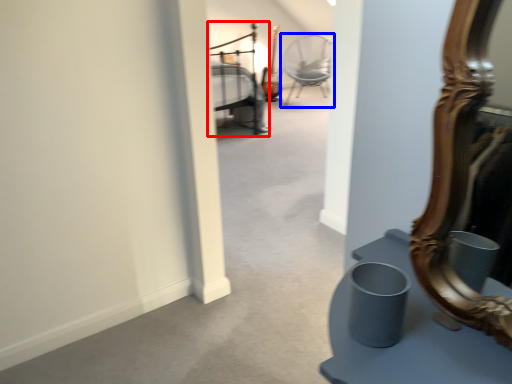
Question: Which object appears farthest to the camera in this image, bed (highlighted by a red box) or chair (highlighted by a blue box)?

Choices:
 (A) bed
 (B) chair

Answer: (B)